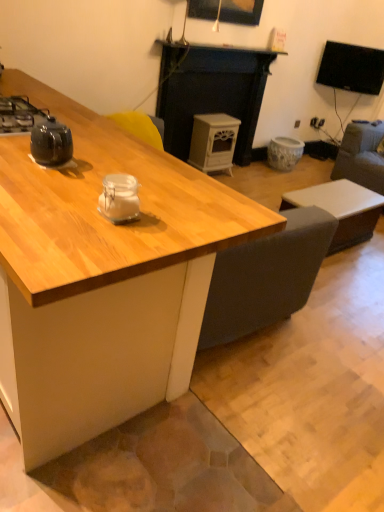
The width and height of the screenshot is (384, 512). In order to click on free space to the back side of matte black teapot at left in this screenshot , I will do `click(96, 149)`.